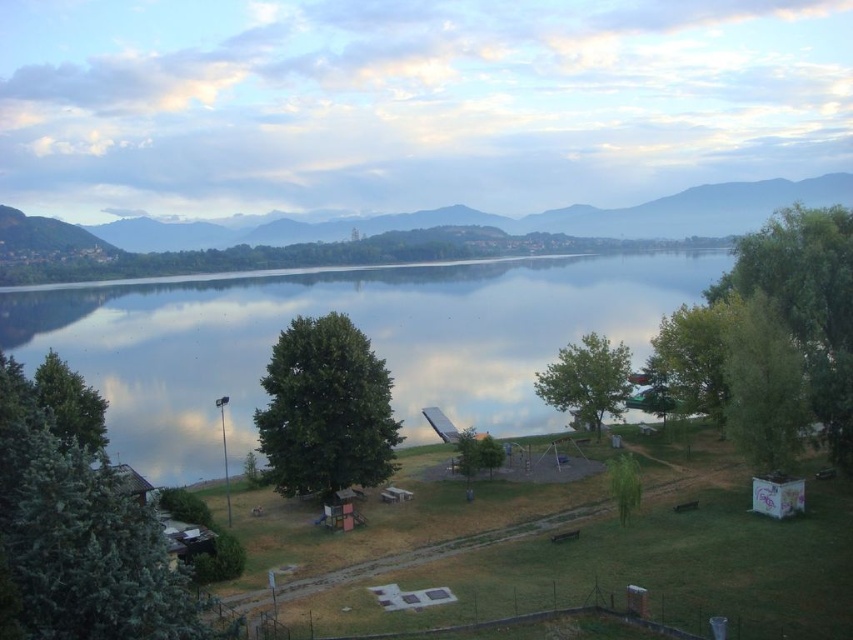
Is glossy reflective water at center smaller than matte gray mountain at center?

Incorrect, glossy reflective water at center is not smaller in size than matte gray mountain at center.

Between glossy reflective water at center and matte gray mountain at center, which one is positioned higher?

Positioned higher is matte gray mountain at center.

Based on the photo, who is more forward, (155,355) or (297,243)?

Point (155,355)

The width and height of the screenshot is (853, 640). Identify the location of glossy reflective water at center. (355, 324).